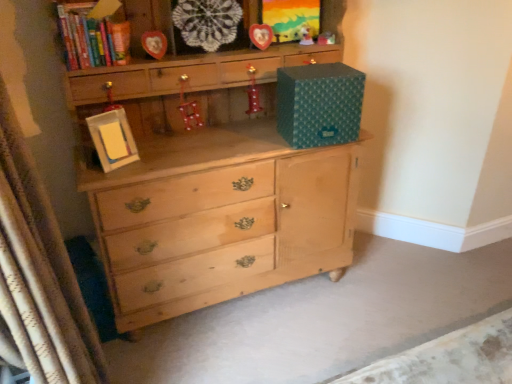
Question: Is shiny red boot at center, the second toy positioned from the bottom, bigger or smaller than wooden heart-shaped frame at upper center, which is the fourth picture frame in bottom-to-top order?

Choices:
 (A) small
 (B) big

Answer: (A)

Question: Considering the positions of shiny red boot at center, which ranks as the 3th toy in top-to-bottom order, and wooden heart-shaped frame at upper center, which is the fourth picture frame in bottom-to-top order, in the image, is shiny red boot at center, which ranks as the 3th toy in top-to-bottom order, taller or shorter than wooden heart-shaped frame at upper center, which is the fourth picture frame in bottom-to-top order,?

Choices:
 (A) tall
 (B) short

Answer: (B)

Question: Considering the real-world distances, which object is farthest from the matte plastic toy at upper center, the first toy viewed from the top?

Choices:
 (A) matte plastic toy at upper center, which is counted as the fourth toy, starting from the left
 (B) hardcover book at upper left
 (C) white textured curtain at left
 (D) wooden heart-shaped frame at upper center, which is the fourth picture frame in bottom-to-top order
 (E) shiny red boot at center, the second toy when ordered from left to right

Answer: (C)

Question: Which of these objects is positioned closest to the wooden heart-shaped frame at upper center, which is the fourth picture frame in bottom-to-top order?

Choices:
 (A) wooden heart at center, acting as the 2th picture frame starting from the right
 (B) hardcover book at upper left
 (C) metallic red ornament at center, which is counted as the first toy, starting from the bottom
 (D) matte wooden picture frame at upper center, which is the 2th picture frame from left to right
 (E) matte plastic toy at upper center, marked as the 3th toy in a left-to-right arrangement

Answer: (E)